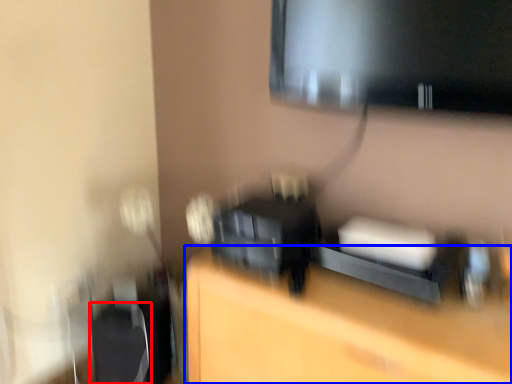
Question: Which of the following is the farthest to the observer, swivel chair (highlighted by a red box) or furniture (highlighted by a blue box)?

Choices:
 (A) swivel chair
 (B) furniture

Answer: (A)